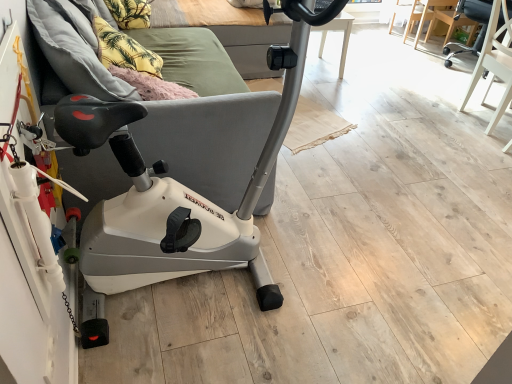
Locate an element on the screen. The image size is (512, 384). vacant space in between white plastic stationary bicycle at left and matte black chair at upper right, which is the second chair in left-to-right order is located at coordinates pyautogui.click(x=365, y=139).